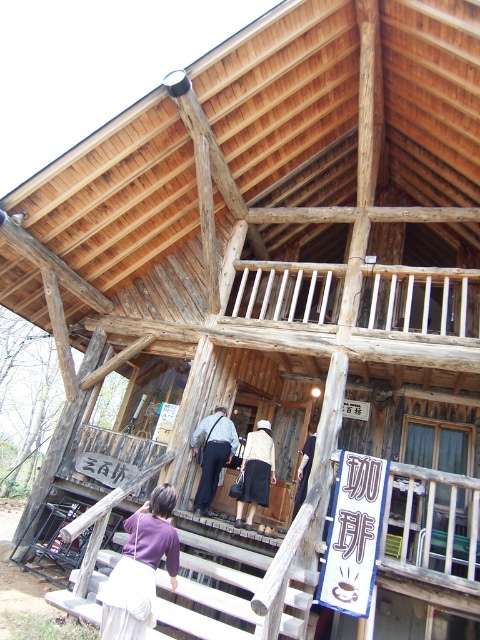
Question: Does purple fabric bag at lower center appear over white cotton shirt at center?

Choices:
 (A) yes
 (B) no

Answer: (B)

Question: Which object is positioned closest to the white wooden balustrade at upper center?

Choices:
 (A) white cotton shirt at center
 (B) dark blue fabric pants at center

Answer: (A)

Question: Is dark gray fabric bag at center to the right of white cotton shirt at center from the viewer's perspective?

Choices:
 (A) no
 (B) yes

Answer: (A)

Question: Estimate the real-world distances between objects in this image. Which object is closer to the purple fabric bag at lower center?

Choices:
 (A) dark gray fabric bag at center
 (B) white wooden balustrade at upper center

Answer: (A)

Question: Among these objects, which one is farthest from the camera?

Choices:
 (A) white cotton shirt at center
 (B) white wooden balustrade at upper center
 (C) dark gray fabric bag at center

Answer: (B)

Question: Observing the image, what is the correct spatial positioning of white wooden balustrade at upper center in reference to purple fabric bag at lower center?

Choices:
 (A) below
 (B) above

Answer: (B)